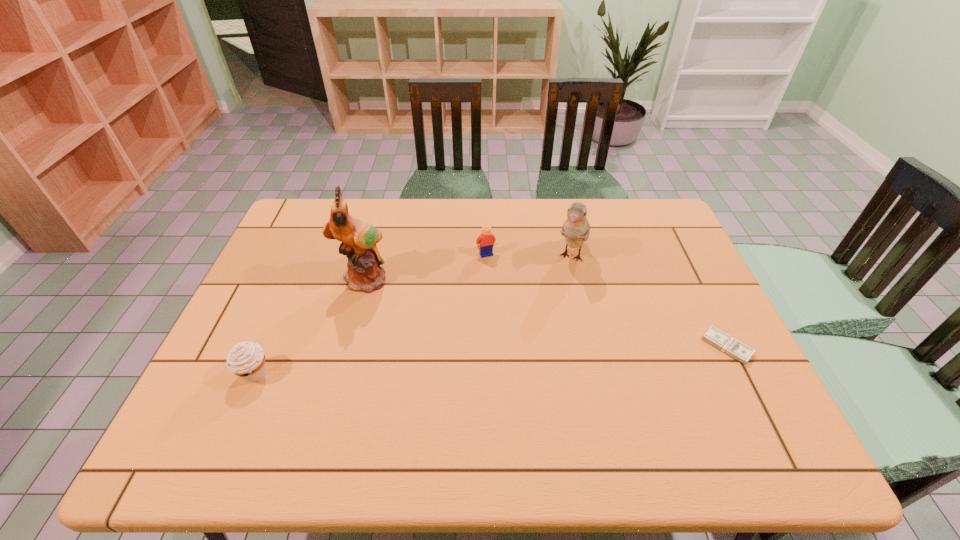
In order to click on free space located 0.070m on the front-facing side of the parrot in this screenshot , I will do `click(384, 308)`.

I want to click on free location located 0.300m on the front-facing side of the parrot, so click(426, 366).

In order to click on vacant space located on the front-facing side of the parrot in this screenshot , I will do `click(384, 308)`.

The height and width of the screenshot is (540, 960). I want to click on vacant region located 0.400m at the face of the second tallest object, so click(524, 382).

The height and width of the screenshot is (540, 960). Find the location of `free space located at the face of the second tallest object`. free space located at the face of the second tallest object is located at coordinates (560, 298).

This screenshot has width=960, height=540. I want to click on vacant space located 0.350m at the face of the second tallest object, so click(x=531, y=366).

Locate an element on the screen. Image resolution: width=960 pixels, height=540 pixels. vacant space located 0.230m on the face of the third object from right to left is located at coordinates (514, 312).

I want to click on blank space located 0.370m on the face of the third object from right to left, so click(x=532, y=352).

Locate an element on the screen. free space located on the face of the third object from right to left is located at coordinates (517, 319).

Locate an element on the screen. The image size is (960, 540). object that is at the far edge is located at coordinates (576, 229).